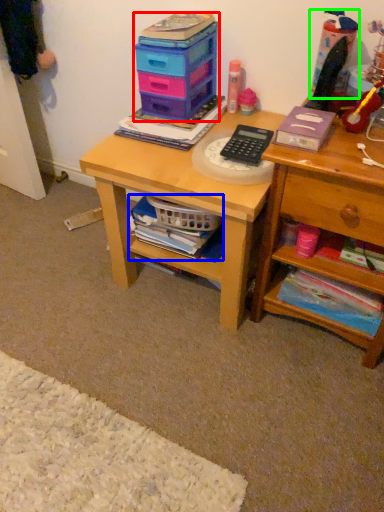
Question: Considering the real-world distances, which object is farthest from storage box (highlighted by a red box)? book (highlighted by a blue box) or toy (highlighted by a green box)?

Choices:
 (A) book
 (B) toy

Answer: (B)